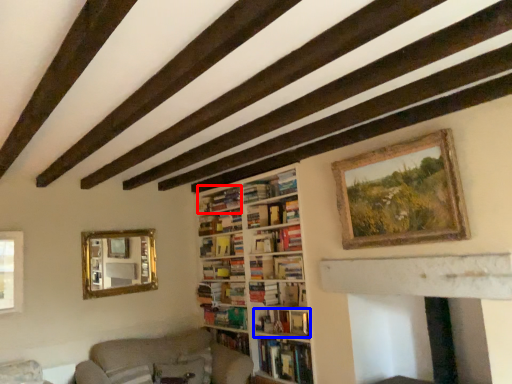
Question: Which point is further to the camera, book (highlighted by a red box) or book (highlighted by a blue box)?

Choices:
 (A) book
 (B) book

Answer: (A)